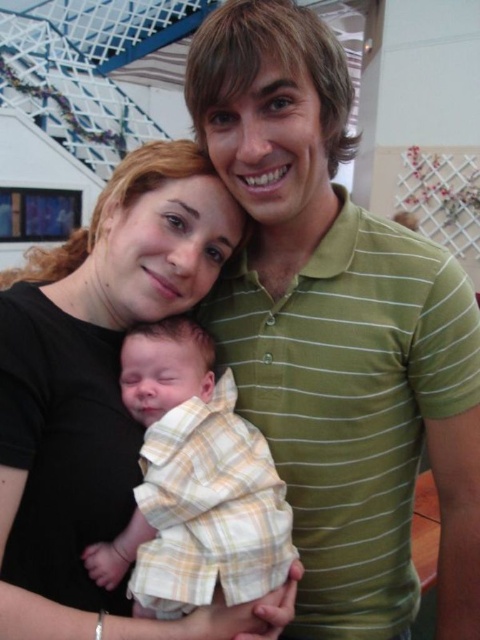
You are a tailor who needs to determine which shirt to alter first. Both the black matte shirt at center and the yellow plaid shirt at center are in front of you. Based on their sizes, which one requires more fabric to adjust for a better fit?

The black matte shirt at center has a larger size compared to the yellow plaid shirt at center, so it requires more fabric to adjust for a better fit.